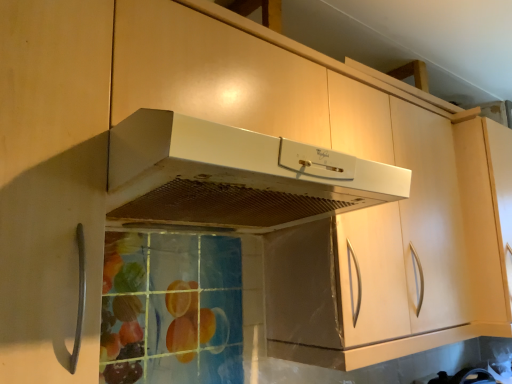
Question: From a real-world perspective, is matte wood cabinet at upper right positioned over white matte range hood at center based on gravity?

Choices:
 (A) no
 (B) yes

Answer: (A)

Question: Is the depth of matte wood cabinet at upper right less than that of white matte range hood at center?

Choices:
 (A) yes
 (B) no

Answer: (B)

Question: Considering the relative sizes of matte wood cabinet at upper right and white matte range hood at center in the image provided, is matte wood cabinet at upper right thinner than white matte range hood at center?

Choices:
 (A) no
 (B) yes

Answer: (B)

Question: Is matte wood cabinet at upper right bigger than white matte range hood at center?

Choices:
 (A) yes
 (B) no

Answer: (A)

Question: Is there a large distance between matte wood cabinet at upper right and white matte range hood at center?

Choices:
 (A) no
 (B) yes

Answer: (A)

Question: Is matte wood cabinet at upper right with white matte range hood at center?

Choices:
 (A) no
 (B) yes

Answer: (A)

Question: Is white matte range hood at center completely or partially outside of matte wood cabinet at upper right?

Choices:
 (A) no
 (B) yes

Answer: (B)

Question: Can you confirm if white matte range hood at center is positioned to the right of matte wood cabinet at upper right?

Choices:
 (A) yes
 (B) no

Answer: (B)

Question: Is white matte range hood at center next to matte wood cabinet at upper right and touching it?

Choices:
 (A) yes
 (B) no

Answer: (B)

Question: Is white matte range hood at center facing away from matte wood cabinet at upper right?

Choices:
 (A) no
 (B) yes

Answer: (A)

Question: Could you tell me if white matte range hood at center is facing matte wood cabinet at upper right?

Choices:
 (A) no
 (B) yes

Answer: (A)

Question: Is matte wood cabinet at upper right inside white matte range hood at center?

Choices:
 (A) no
 (B) yes

Answer: (A)

Question: From a real-world perspective, relative to matte wood cabinet at upper right, is white matte range hood at center vertically above or below?

Choices:
 (A) above
 (B) below

Answer: (A)